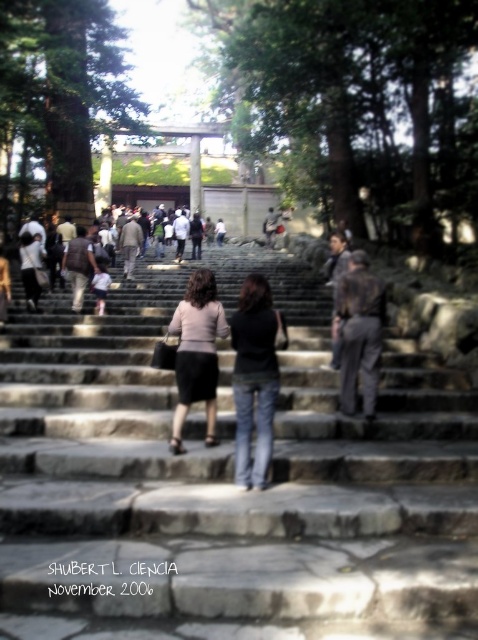
You are standing at the bottom of the stone steps and see the black denim jeans at center and the matte pink sweater at center. Which one is closer to you?

The black denim jeans at center is positioned under the matte pink sweater at center, so the black denim jeans at center is closer to you.

You are standing at the bottom of the stone steps and see the black denim jeans at center and the dark gray suit at center. Which person is closer to you?

The black denim jeans at center is positioned under the dark gray suit at center, so the black denim jeans at center is closer to you.

Where is the black denim jeans at center located in the image?

The black denim jeans at center is located at point (x=254, y=378) in the image.